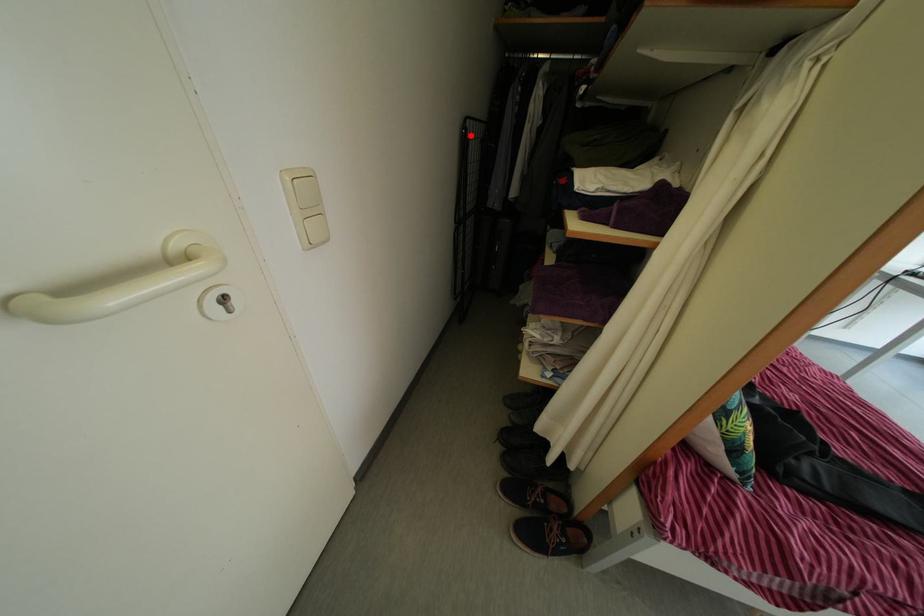
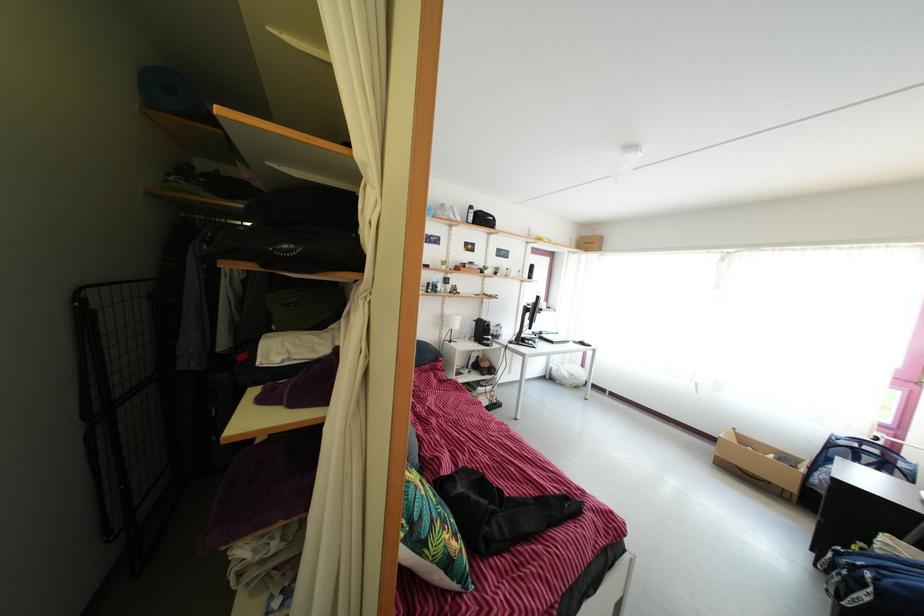
Question: I am providing you with two images of the same scene from different viewpoints. Image1 has a red point marked. In image2, the corresponding 3D location appears at what relative position? Reply with the corresponding letter.

Choices:
 (A) Closer
 (B) Farther

Answer: (B)